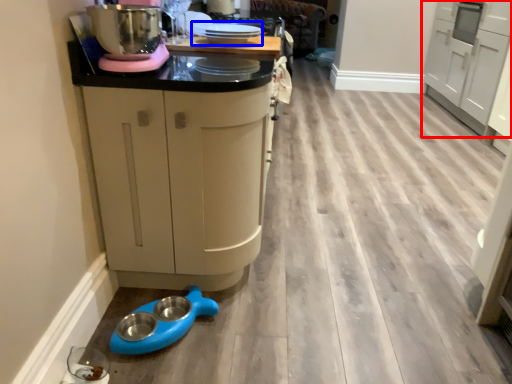
Question: Which point is further to the camera, cabinetry (highlighted by a red box) or appliance (highlighted by a blue box)?

Choices:
 (A) cabinetry
 (B) appliance

Answer: (A)